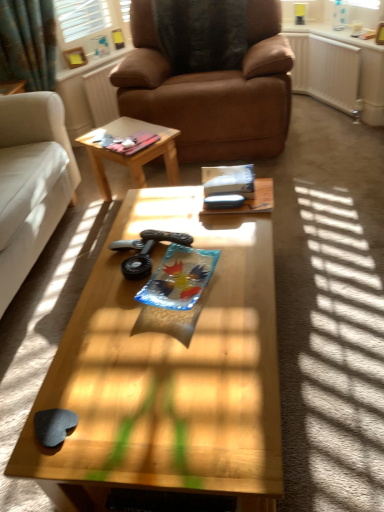
This screenshot has width=384, height=512. Find the location of `wooden at center, acting as the first coffee table starting from the back`. wooden at center, acting as the first coffee table starting from the back is located at coordinates (132, 155).

The height and width of the screenshot is (512, 384). Describe the element at coordinates (47, 192) in the screenshot. I see `white fabric studio couch at left` at that location.

What do you see at coordinates (325, 70) in the screenshot?
I see `white plastic radiator at upper right, arranged as the second radiator when viewed from the left` at bounding box center [325, 70].

At what (x,y) coordinates should I click in order to perform the action: click on wooden at center, acting as the first coffee table starting from the back. Please return your answer as a coordinate pair (x, y). Looking at the image, I should click on (132, 155).

Which point is more distant from viewer, [147,247] or [114,61]?

The point [114,61] is more distant.

Would you say brown leather radiator at upper center, the 2th radiator in the right-to-left sequence, is part of black plastic game controller at center's contents?

No, brown leather radiator at upper center, the 2th radiator in the right-to-left sequence, is located outside of black plastic game controller at center.

How many degrees apart are the facing directions of black plastic game controller at center and brown leather radiator at upper center, acting as the first radiator starting from the left?

The angle between the facing direction of black plastic game controller at center and the facing direction of brown leather radiator at upper center, acting as the first radiator starting from the left, is 71.2 degrees.

Is black plastic game controller at center with brown leather radiator at upper center, acting as the first radiator starting from the left?

No, black plastic game controller at center is not in contact with brown leather radiator at upper center, acting as the first radiator starting from the left.

The width and height of the screenshot is (384, 512). Find the location of `studio couch that is below the brown leather radiator at upper center, acting as the first radiator starting from the left (from the image's perspective)`. studio couch that is below the brown leather radiator at upper center, acting as the first radiator starting from the left (from the image's perspective) is located at coordinates (47, 192).

Is brown leather radiator at upper center, acting as the first radiator starting from the left, to the right of white fabric studio couch at left from the viewer's perspective?

Indeed, brown leather radiator at upper center, acting as the first radiator starting from the left, is positioned on the right side of white fabric studio couch at left.

Is brown leather radiator at upper center, acting as the first radiator starting from the left, far away from white fabric studio couch at left?

Yes, brown leather radiator at upper center, acting as the first radiator starting from the left, and white fabric studio couch at left are located far from each other.

Relative to white fabric studio couch at left, is brown leather radiator at upper center, acting as the first radiator starting from the left, in front or behind?

brown leather radiator at upper center, acting as the first radiator starting from the left, is positioned farther from the viewer than white fabric studio couch at left.

From the picture: Is wooden at center, acting as the first coffee table starting from the back, positioned far away from wooden coffee table at center, which is the first coffee table in front-to-back order?

Yes.

Which of these two, wooden at center, acting as the second coffee table starting from the bottom, or wooden coffee table at center, acting as the 2th coffee table starting from the top, is wider?

With larger width is wooden coffee table at center, acting as the 2th coffee table starting from the top.

Identify the location of coffee table directly beneath the wooden coffee table at center, acting as the second coffee table starting from the back (from a real-world perspective). (132, 155).

Between white fabric studio couch at left and black plastic game controller at center, which one is positioned behind?

black plastic game controller at center is further away from the camera.

From a real-world perspective, is white fabric studio couch at left under black plastic game controller at center?

No, from a real-world perspective, white fabric studio couch at left is not under black plastic game controller at center.

Is black plastic game controller at center a part of white fabric studio couch at left?

That's incorrect, black plastic game controller at center is not inside white fabric studio couch at left.

Is white fabric studio couch at left next to black plastic game controller at center and touching it?

white fabric studio couch at left and black plastic game controller at center are clearly separated.

Is wooden coffee table at center, which is the first coffee table in front-to-back order, directly adjacent to brown leather radiator at upper center, acting as the first radiator starting from the left?

No.

Considering the sizes of wooden coffee table at center, which is the first coffee table in front-to-back order, and brown leather radiator at upper center, acting as the first radiator starting from the left, in the image, is wooden coffee table at center, which is the first coffee table in front-to-back order, wider or thinner than brown leather radiator at upper center, acting as the first radiator starting from the left,?

wooden coffee table at center, which is the first coffee table in front-to-back order, is wider than brown leather radiator at upper center, acting as the first radiator starting from the left.

From the image's perspective, is wooden coffee table at center, which is the first coffee table in front-to-back order, below white plastic radiator at upper right, arranged as the second radiator when viewed from the left?

Indeed, from the image's perspective, wooden coffee table at center, which is the first coffee table in front-to-back order, is shown beneath white plastic radiator at upper right, arranged as the second radiator when viewed from the left.

Consider the image. Is wooden coffee table at center, which appears as the first coffee table when ordered from the bottom, oriented towards white plastic radiator at upper right, arranged as the second radiator when viewed from the left?

No.

Which radiator is the 1st one when counting from the back of the wooden coffee table at center, acting as the second coffee table starting from the back? Please provide its 2D coordinates.

[(325, 70)]

Who is smaller, white plastic radiator at upper right, placed as the first radiator when sorted from right to left, or wooden coffee table at center, acting as the 2th coffee table starting from the top?

With smaller size is white plastic radiator at upper right, placed as the first radiator when sorted from right to left.

Which point is more distant from viewer, (x=314, y=70) or (x=46, y=401)?

The point (x=314, y=70) is farther from the camera.

Which object is positioned more to the right, white plastic radiator at upper right, placed as the first radiator when sorted from right to left, or wooden coffee table at center, which is the first coffee table in front-to-back order?

white plastic radiator at upper right, placed as the first radiator when sorted from right to left.

Is white plastic radiator at upper right, arranged as the second radiator when viewed from the left, behind wooden coffee table at center, acting as the 2th coffee table starting from the top?

Yes, white plastic radiator at upper right, arranged as the second radiator when viewed from the left, is further from the viewer.

This screenshot has height=512, width=384. Identify the location of game controller positioned vertically above the brown leather radiator at upper center, the 2th radiator in the right-to-left sequence (from a real-world perspective). (146, 251).

This screenshot has height=512, width=384. In order to click on studio couch that appears in front of the brown leather radiator at upper center, the 2th radiator in the right-to-left sequence in this screenshot , I will do `click(47, 192)`.

When comparing their distances from black plastic game controller at center, does wooden at center, acting as the first coffee table starting from the back, or white plastic radiator at upper right, arranged as the second radiator when viewed from the left, seem closer?

Based on the image, wooden at center, acting as the first coffee table starting from the back, appears to be nearer to black plastic game controller at center.

Considering their positions, is wooden at center, the first coffee table positioned from the top, positioned further to brown leather chair at center than brown leather radiator at upper center, the 2th radiator in the right-to-left sequence?

The object further to brown leather chair at center is brown leather radiator at upper center, the 2th radiator in the right-to-left sequence.

Consider the image. Based on their spatial positions, is brown leather radiator at upper center, acting as the first radiator starting from the left, or wooden at center, the first coffee table positioned from the top, closer to white plastic radiator at upper right, arranged as the second radiator when viewed from the left?

wooden at center, the first coffee table positioned from the top.

Estimate the real-world distances between objects in this image. Which object is closer to white fabric studio couch at left, wooden coffee table at center, which is the first coffee table in front-to-back order, or brown leather radiator at upper center, the 2th radiator in the right-to-left sequence?

wooden coffee table at center, which is the first coffee table in front-to-back order, is positioned closer to the anchor white fabric studio couch at left.

Estimate the real-world distances between objects in this image. Which object is further from brown leather chair at center, white fabric studio couch at left or brown leather radiator at upper center, acting as the first radiator starting from the left?

Among the two, brown leather radiator at upper center, acting as the first radiator starting from the left, is located further to brown leather chair at center.

From the image, which object appears to be farther from black plastic game controller at center, white plastic radiator at upper right, placed as the first radiator when sorted from right to left, or brown leather chair at center?

white plastic radiator at upper right, placed as the first radiator when sorted from right to left, is positioned further to the anchor black plastic game controller at center.

Looking at the image, which one is located further to brown leather chair at center, white plastic radiator at upper right, placed as the first radiator when sorted from right to left, or white fabric studio couch at left?

white fabric studio couch at left lies further to brown leather chair at center than the other object.

Considering their positions, is brown leather chair at center positioned further to wooden coffee table at center, which appears as the first coffee table when ordered from the bottom, than brown leather radiator at upper center, acting as the first radiator starting from the left?

Based on the image, brown leather radiator at upper center, acting as the first radiator starting from the left, appears to be further to wooden coffee table at center, which appears as the first coffee table when ordered from the bottom.

Where is `chair between white plastic radiator at upper right, arranged as the second radiator when viewed from the left, and black plastic game controller at center in the up-down direction`? This screenshot has height=512, width=384. chair between white plastic radiator at upper right, arranged as the second radiator when viewed from the left, and black plastic game controller at center in the up-down direction is located at coordinates (212, 90).

Identify the location of chair between wooden coffee table at center, which appears as the first coffee table when ordered from the bottom, and white plastic radiator at upper right, arranged as the second radiator when viewed from the left, from front to back. (212, 90).

Find the location of `studio couch between wooden coffee table at center, acting as the second coffee table starting from the back, and brown leather radiator at upper center, acting as the first radiator starting from the left, in the front-back direction`. studio couch between wooden coffee table at center, acting as the second coffee table starting from the back, and brown leather radiator at upper center, acting as the first radiator starting from the left, in the front-back direction is located at coordinates (47, 192).

At what (x,y) coordinates should I click in order to perform the action: click on coffee table between black plastic game controller at center and brown leather radiator at upper center, acting as the first radiator starting from the left, along the z-axis. Please return your answer as a coordinate pair (x, y). The width and height of the screenshot is (384, 512). Looking at the image, I should click on (132, 155).